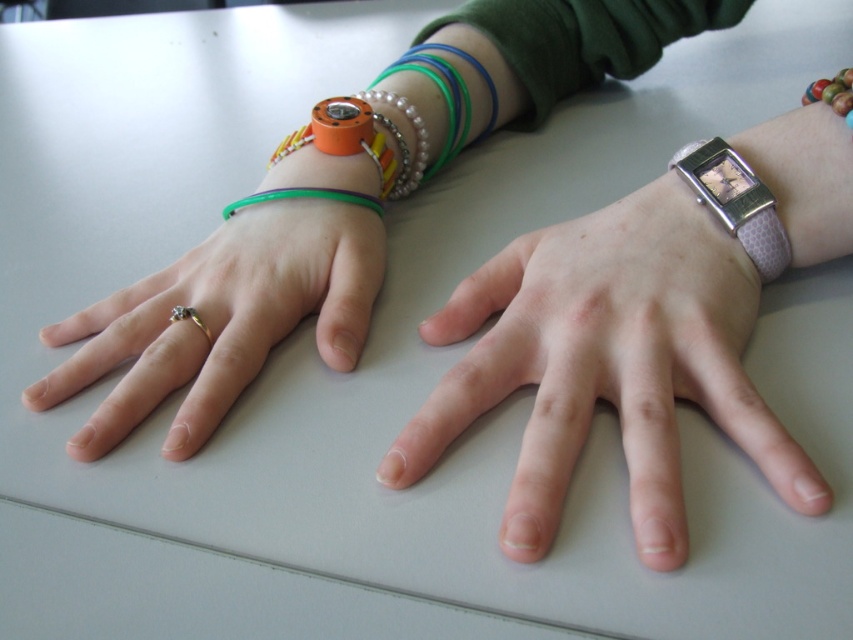
Who is higher up, white matte watch at right or pink leather watch at right?

pink leather watch at right is above.

Is white matte watch at right taller than pink leather watch at right?

Yes, white matte watch at right is taller than pink leather watch at right.

Describe the element at coordinates (608, 364) in the screenshot. I see `white matte watch at right` at that location.

The width and height of the screenshot is (853, 640). What are the coordinates of `white matte watch at right` in the screenshot? It's located at pos(608,364).

Which is more to the right, white matte watch at right or gold metallic ring at left?

From the viewer's perspective, white matte watch at right appears more on the right side.

Between white matte watch at right and gold metallic ring at left, which one appears on the left side from the viewer's perspective?

gold metallic ring at left

Is point (804, 252) behind point (368, 243)?

No, it is not.

Locate an element on the screen. This screenshot has height=640, width=853. white matte watch at right is located at coordinates (608, 364).

Can you confirm if white matte watch at right is positioned to the right of green rubber bracelet at left?

Yes, white matte watch at right is to the right of green rubber bracelet at left.

Which is behind, point (634, 476) or point (341, 196)?

The point (341, 196) is behind.

The image size is (853, 640). I want to click on white matte watch at right, so [608, 364].